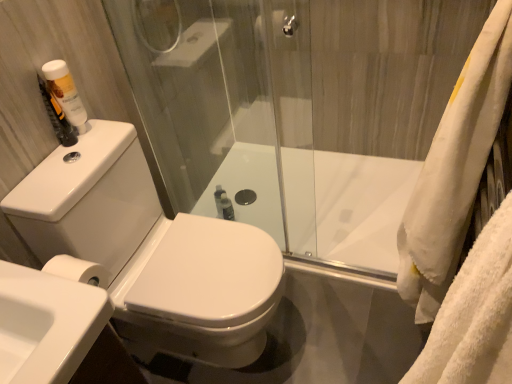
At what (x,y) coordinates should I click in order to perform the action: click on free spot in front of transparent glass shower door at upper right. Please return your answer as a coordinate pair (x, y). The height and width of the screenshot is (384, 512). Looking at the image, I should click on (353, 325).